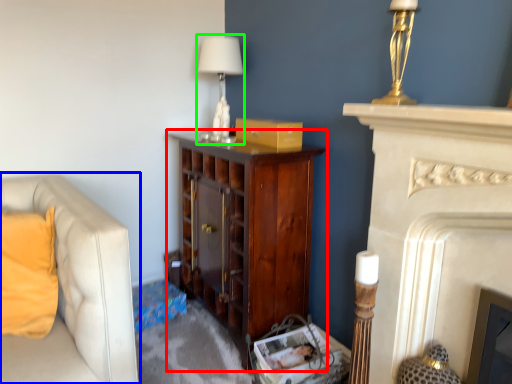
Question: Based on their relative distances, which object is nearer to cabinetry (highlighted by a red box)? Choose from studio couch (highlighted by a blue box) and table lamp (highlighted by a green box).

Choices:
 (A) studio couch
 (B) table lamp

Answer: (B)